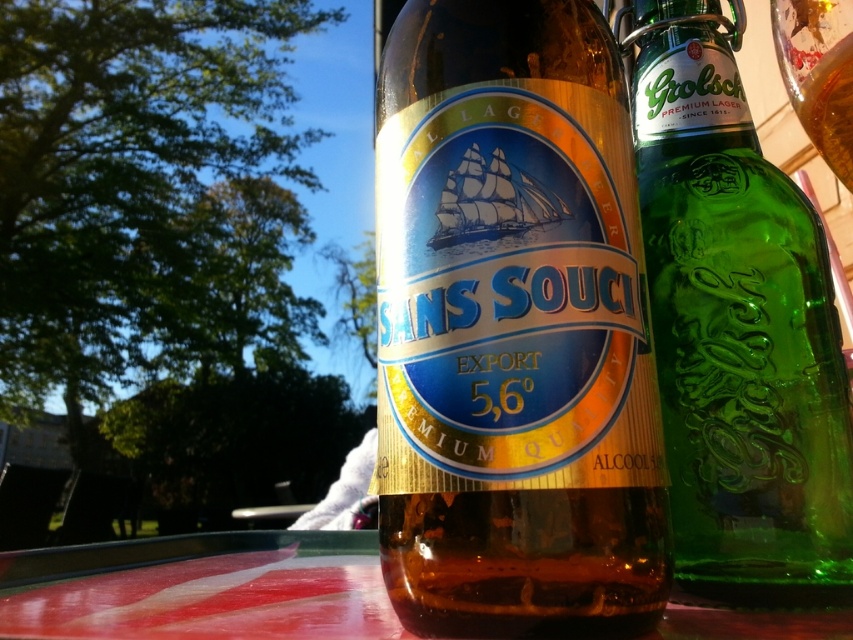
You are setting up a small table for a party and need to place both the smooth glossy table at center and the transparent glass at upper right on it. Given their sizes, which object should you place first to ensure stability?

The smooth glossy table at center is larger in size than the transparent glass at upper right, so you should place the smooth glossy table at center first to ensure stability.

You are at a picnic and want to grab the green glass bottle at right and the smooth glossy table at center. Which one is closer to your right hand?

The green glass bottle at right is to the right of smooth glossy table at center, so it is closer to your right hand.

You are trying to reach for the green glass bottle at right while standing behind the smooth glossy table at center. Can you grab it without moving the table?

The green glass bottle at right is further to the viewer than the smooth glossy table at center, meaning it is closer to you. Therefore, you can grab it without moving the table.